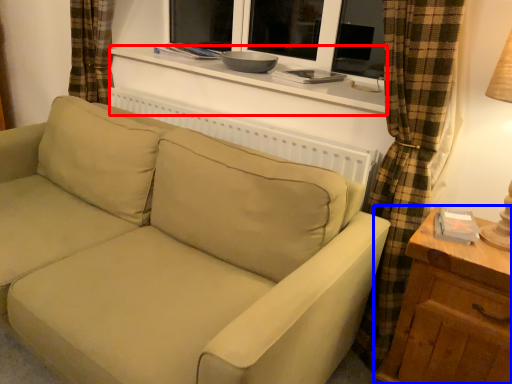
Question: Which of the following is the farthest to the observer, window sill (highlighted by a red box) or table (highlighted by a blue box)?

Choices:
 (A) window sill
 (B) table

Answer: (A)